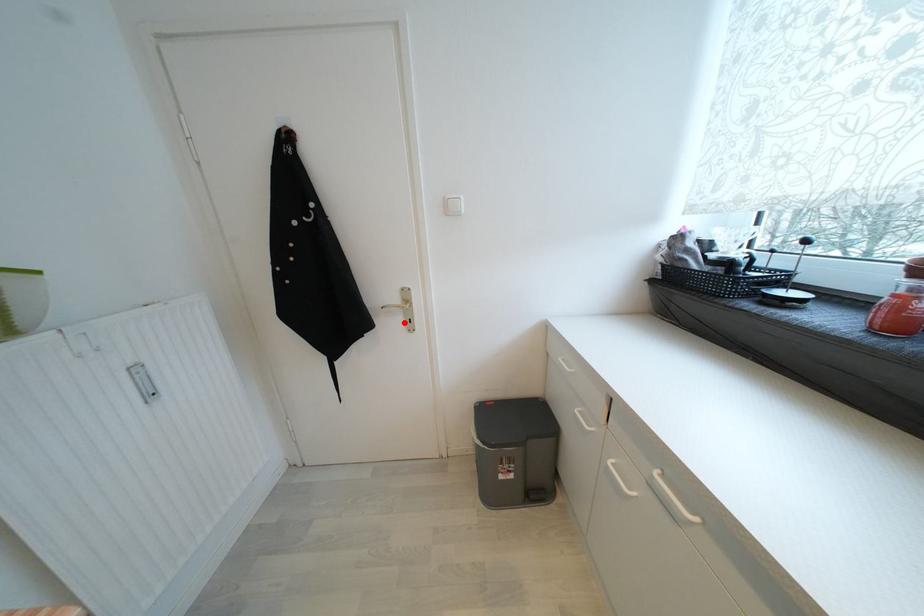
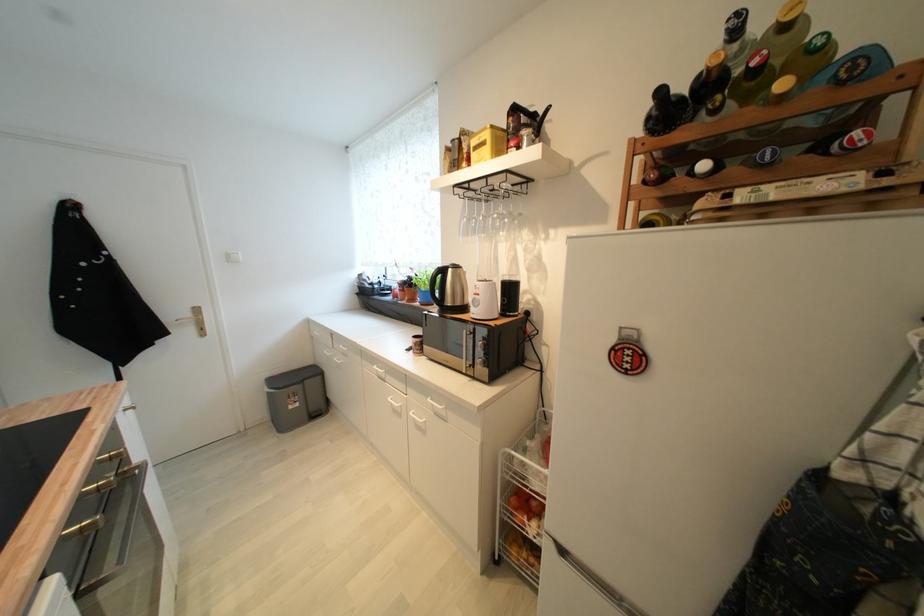
Find the pixel in the second image that matches the highlighted location in the first image.

(197, 331)